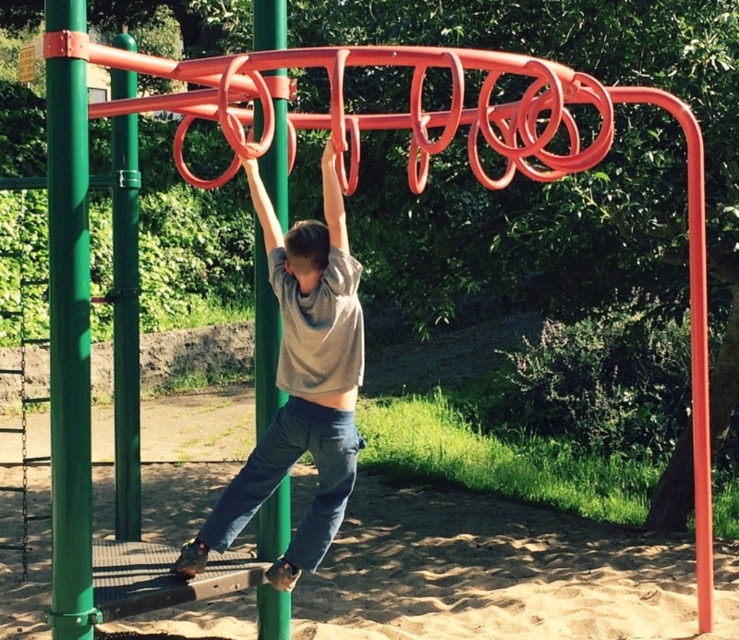
Question: Which point is farther to the camera?

Choices:
 (A) (197, 547)
 (B) (231, 470)

Answer: (B)

Question: Is sandy brown at lower center to the right of green matte pole at left from the viewer's perspective?

Choices:
 (A) yes
 (B) no

Answer: (A)

Question: Which of the following is the closest to the observer?

Choices:
 (A) gray cotton shirt at center
 (B) sandy brown at lower center

Answer: (A)

Question: Does green matte pole at left have a smaller size compared to green matte pole at center?

Choices:
 (A) no
 (B) yes

Answer: (B)

Question: Among these objects, which one is nearest to the camera?

Choices:
 (A) gray cotton shirt at center
 (B) green matte pole at center

Answer: (A)

Question: Observing the image, what is the correct spatial positioning of gray cotton shirt at center in reference to green matte pole at left?

Choices:
 (A) left
 (B) right

Answer: (B)